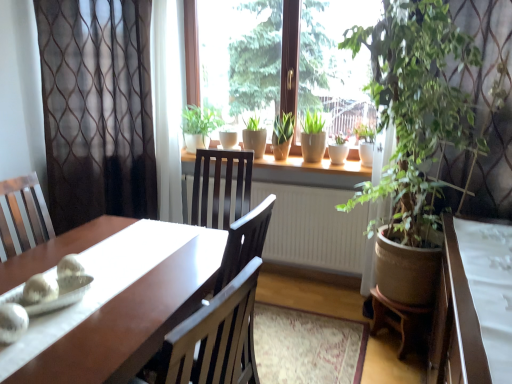
Question: Is sheer brown curtain at left, the second curtain from the right, at the left side of green matte plant at center, the fifth houseplant in the right-to-left sequence?

Choices:
 (A) yes
 (B) no

Answer: (A)

Question: Does sheer brown curtain at left, the second curtain from the right, have a greater width compared to green matte plant at center, the first houseplant in the left-to-right sequence?

Choices:
 (A) no
 (B) yes

Answer: (A)

Question: Could you tell me if sheer brown curtain at left, the second curtain from the right, is facing green matte plant at center, the fifth houseplant in the right-to-left sequence?

Choices:
 (A) no
 (B) yes

Answer: (A)

Question: Can you confirm if sheer brown curtain at left, the 1th curtain positioned from the left, is taller than green matte plant at center, the fifth houseplant in the right-to-left sequence?

Choices:
 (A) yes
 (B) no

Answer: (A)

Question: Is sheer brown curtain at left, the 1th curtain positioned from the left, oriented away from green matte plant at center, the fifth houseplant in the right-to-left sequence?

Choices:
 (A) yes
 (B) no

Answer: (B)

Question: Considering the relative sizes of sheer brown curtain at left, the second curtain from the right, and green matte plant at center, the fifth houseplant in the right-to-left sequence, in the image provided, is sheer brown curtain at left, the second curtain from the right, smaller than green matte plant at center, the fifth houseplant in the right-to-left sequence,?

Choices:
 (A) yes
 (B) no

Answer: (B)

Question: Considering the relative sizes of green leafy plant at right, which is the 5th houseplant in left-to-right order, and green matte plant at window, which is the fourth houseplant in right-to-left order, in the image provided, is green leafy plant at right, which is the 5th houseplant in left-to-right order, shorter than green matte plant at window, which is the fourth houseplant in right-to-left order,?

Choices:
 (A) yes
 (B) no

Answer: (B)

Question: From a real-world perspective, does green leafy plant at right, which is the 5th houseplant in left-to-right order, stand above green matte plant at window, which is the fourth houseplant in right-to-left order?

Choices:
 (A) yes
 (B) no

Answer: (B)

Question: Is green leafy plant at right, which is the 5th houseplant in left-to-right order, smaller than green matte plant at window, which ranks as the second houseplant in left-to-right order?

Choices:
 (A) no
 (B) yes

Answer: (A)

Question: Considering the relative sizes of green leafy plant at right, which is the 5th houseplant in left-to-right order, and green matte plant at window, which is the fourth houseplant in right-to-left order, in the image provided, is green leafy plant at right, which is the 5th houseplant in left-to-right order, bigger than green matte plant at window, which is the fourth houseplant in right-to-left order,?

Choices:
 (A) yes
 (B) no

Answer: (A)

Question: Is green leafy plant at right, which is the 5th houseplant in left-to-right order, positioned in front of green matte plant at window, which ranks as the second houseplant in left-to-right order?

Choices:
 (A) yes
 (B) no

Answer: (A)

Question: Is green leafy plant at right, which is the 5th houseplant in left-to-right order, to the right of green matte plant at window, which is the fourth houseplant in right-to-left order, from the viewer's perspective?

Choices:
 (A) no
 (B) yes

Answer: (B)

Question: Is green matte pot at center, the second houseplant from the right, next to green matte plant at window, which is the fourth houseplant in right-to-left order, and touching it?

Choices:
 (A) yes
 (B) no

Answer: (B)